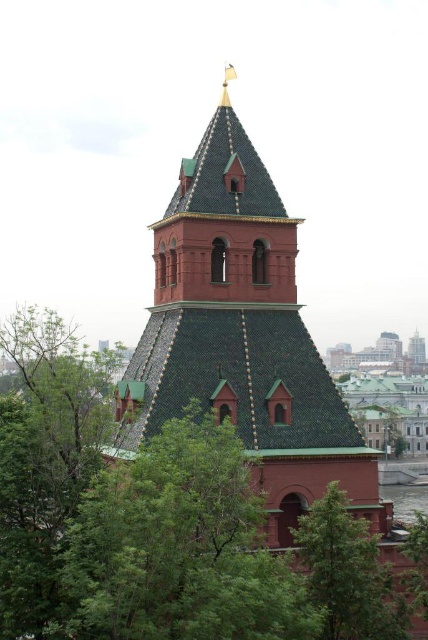
You are planning to install a bench between the green textured leaves at center and the green tiled tower at center. If the bench requires 10 meters of space, will there be enough room?

The green textured leaves at center and green tiled tower at center are 9.76 meters apart from each other, so the bench requiring 10 meters of space will not fit between them.

You are standing in a park and see the green textured leaves at center and the green tiled tower at center. Which object is closer to you?

The green textured leaves at center are closer to you because they are in front of the green tiled tower at center.